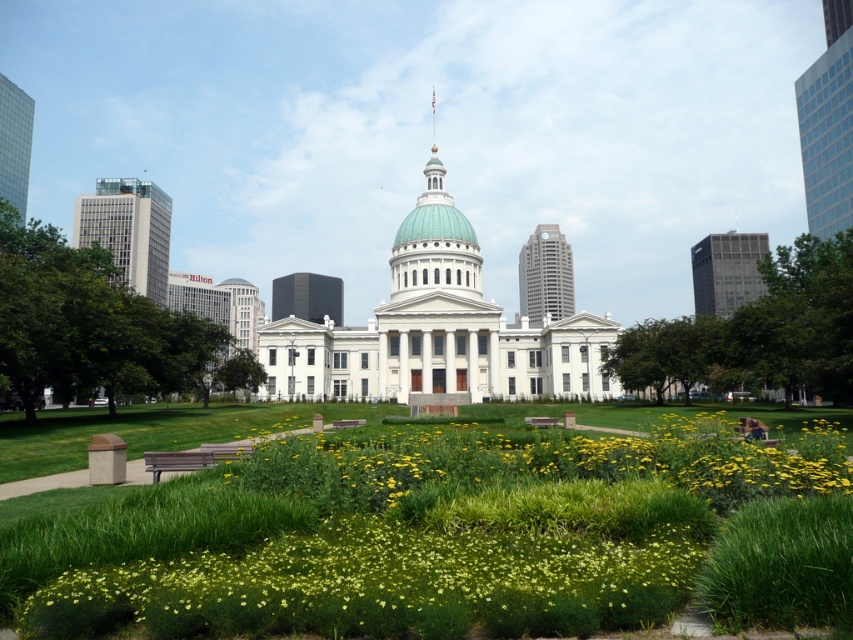
Question: Among these objects, which one is nearest to the camera?

Choices:
 (A) brown wooden park bench at center
 (B) wooden park bench at center
 (C) green grass at center

Answer: (C)

Question: Does green grass at center appear on the right side of wooden park bench at center?

Choices:
 (A) yes
 (B) no

Answer: (A)

Question: Based on their relative distances, which object is farther from the brown wooden park bench at center?

Choices:
 (A) wooden park bench at center
 (B) green grass at center

Answer: (B)

Question: Is wooden park bench at lower left further to the viewer compared to brown wooden park bench at center?

Choices:
 (A) yes
 (B) no

Answer: (B)

Question: Does wooden park bench at lower left have a larger size compared to brown wooden park bench at center?

Choices:
 (A) no
 (B) yes

Answer: (B)

Question: Which point is farther from the camera taking this photo?

Choices:
 (A) click(x=532, y=419)
 (B) click(x=352, y=424)
 (C) click(x=248, y=444)
 (D) click(x=654, y=566)

Answer: (A)